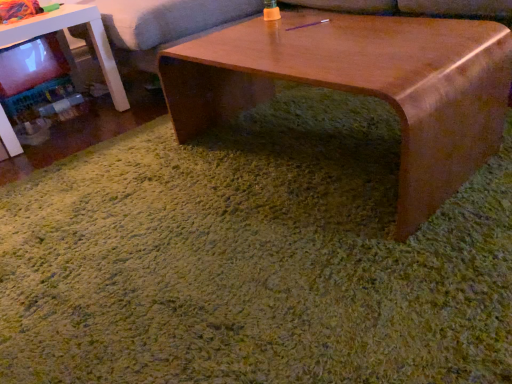
Question: From the image's perspective, is white glossy table at left positioned above or below wooden coffee table at center?

Choices:
 (A) below
 (B) above

Answer: (B)

Question: In terms of width, does white glossy table at left look wider or thinner when compared to wooden coffee table at center?

Choices:
 (A) thin
 (B) wide

Answer: (B)

Question: Considering the real-world distances, which object is farthest from the wooden coffee table at center?

Choices:
 (A) white glossy table at left
 (B) soft gray couch at upper center

Answer: (A)

Question: Which object is positioned closest to the soft gray couch at upper center?

Choices:
 (A) wooden coffee table at center
 (B) white glossy table at left

Answer: (B)